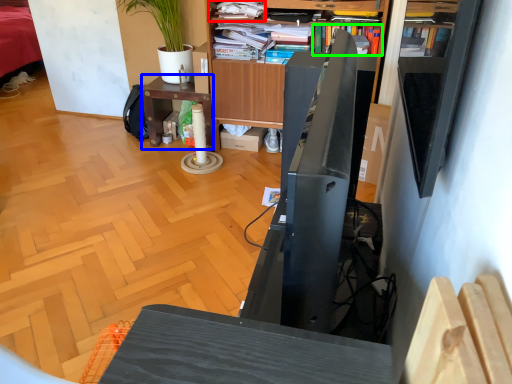
Question: Estimate the real-world distances between objects in this image. Which object is closer to shelf (highlighted by a red box), desk (highlighted by a blue box) or book (highlighted by a green box)?

Choices:
 (A) desk
 (B) book

Answer: (B)